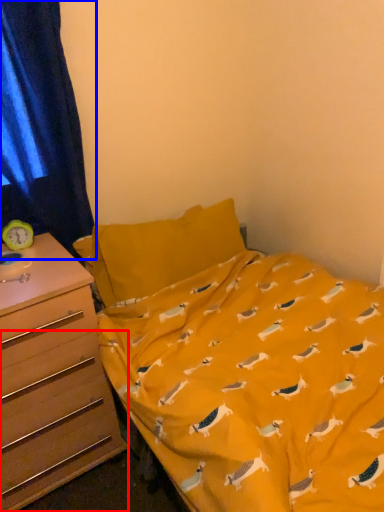
Question: Among these objects, which one is nearest to the camera, drawer (highlighted by a red box) or curtain (highlighted by a blue box)?

Choices:
 (A) drawer
 (B) curtain

Answer: (A)